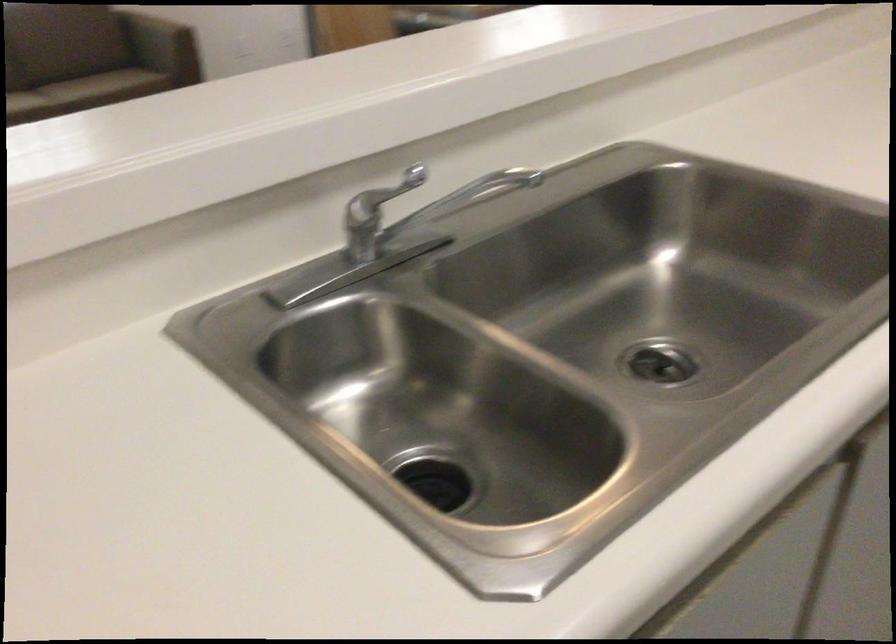
Where would you sitting on the sofa sitting surface? Please return your answer as a coordinate pair (x, y).

(82, 93)